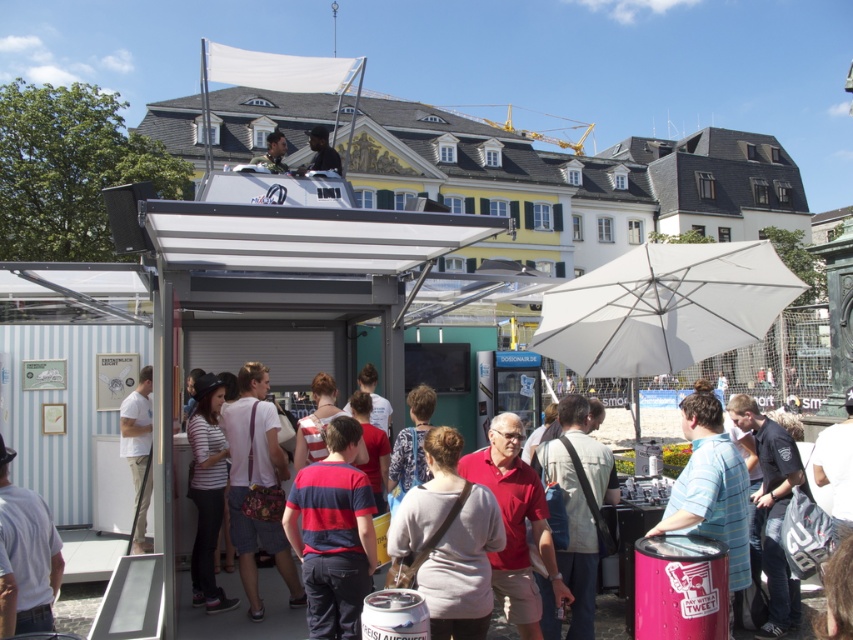
Question: Which object appears closest to the camera in this image?

Choices:
 (A) white cotton shirt at center
 (B) matte black shirt at upper center

Answer: (A)

Question: Which point is closer to the camera?

Choices:
 (A) matte black shirt at upper center
 (B) white cotton shirt at center

Answer: (B)

Question: Which point is farther to the camera?

Choices:
 (A) (322, 144)
 (B) (146, 464)

Answer: (A)

Question: Can you confirm if white matte umbrella at center is positioned above white cotton shirt at center?

Choices:
 (A) yes
 (B) no

Answer: (A)

Question: Is white matte umbrella at center positioned before white cotton shirt at center?

Choices:
 (A) no
 (B) yes

Answer: (B)

Question: In this image, where is white cotton shirt at center located relative to matte black shirt at upper center?

Choices:
 (A) above
 (B) below

Answer: (B)